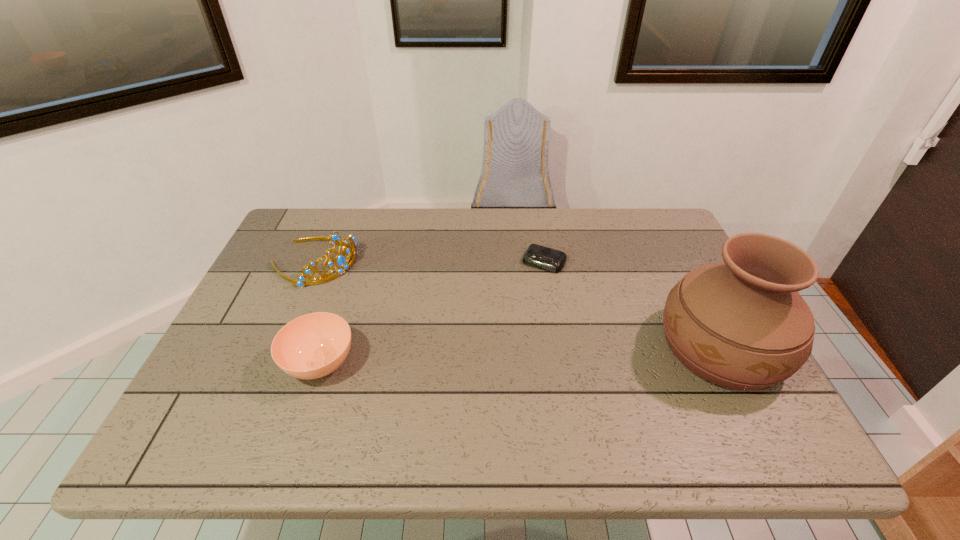
Locate an element on the screen. object present at the far left corner is located at coordinates (340, 260).

Identify the location of object located at the near right corner. (742, 324).

In the image, there is a desktop. Identify the location of vacant area at the far edge. (608, 216).

In the image, there is a desktop. Where is `free space at the near edge`? free space at the near edge is located at coordinates coord(399,390).

Where is `vacant space at the left edge`? The width and height of the screenshot is (960, 540). vacant space at the left edge is located at coordinates (263, 365).

Locate an element on the screen. This screenshot has height=540, width=960. vacant region at the right edge of the desktop is located at coordinates (653, 300).

At what (x,y) coordinates should I click in order to perform the action: click on vacant region at the far left corner of the desktop. Please return your answer as a coordinate pair (x, y). Looking at the image, I should click on point(324,217).

Image resolution: width=960 pixels, height=540 pixels. Identify the location of vacant space at the near left corner. (268, 388).

Locate an element on the screen. free region at the far right corner of the desktop is located at coordinates (637, 252).

This screenshot has width=960, height=540. In order to click on vacant space that's between the rightmost object and the tiara in this screenshot , I will do `click(517, 305)`.